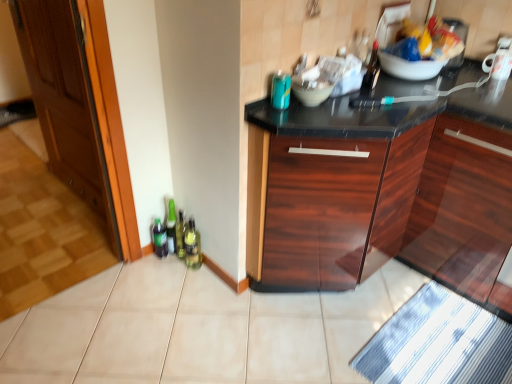
Question: Considering their positions, is matte white bowl at center located in front of or behind green glass bottle at lower left?

Choices:
 (A) behind
 (B) front

Answer: (B)

Question: From a real-world perspective, is matte white bowl at center above or below green glass bottle at lower left?

Choices:
 (A) below
 (B) above

Answer: (B)

Question: Estimate the real-world distances between objects in this image. Which object is farther from the matte white bowl at center?

Choices:
 (A) plastic bag of chips at upper center
 (B) blue striped bath mat at lower right
 (C) wooden at left
 (D) white glossy mug at upper right
 (E) glossy wood cabinet at center

Answer: (C)

Question: Which object is positioned closest to the wooden at left?

Choices:
 (A) green glass bottle at lower left
 (B) blue striped bath mat at lower right
 (C) glossy wood cabinet at center
 (D) matte white bowl at center
 (E) plastic bag of chips at upper center

Answer: (A)